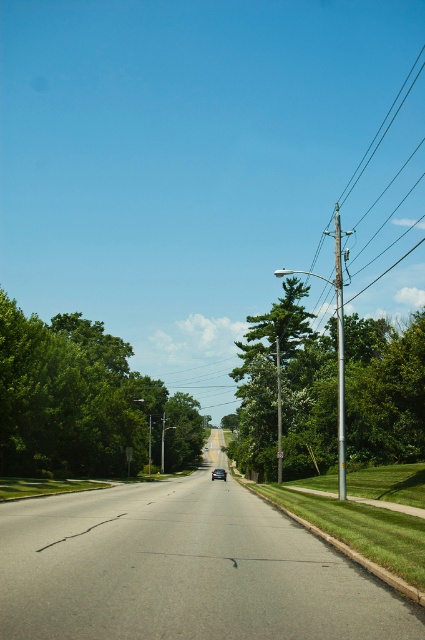
Can you confirm if green leafy tree at center-right is positioned to the right of shiny black sedan at center?

Correct, you'll find green leafy tree at center-right to the right of shiny black sedan at center.

Is green leafy tree at center-right to the left of shiny black sedan at center from the viewer's perspective?

In fact, green leafy tree at center-right is to the right of shiny black sedan at center.

The width and height of the screenshot is (425, 640). Find the location of `green leafy tree at center-right`. green leafy tree at center-right is located at coordinates (272, 378).

Looking at this image, who is more forward, (271, 368) or (285, 314)?

Point (271, 368) is in front.

Is green leafy tree at right smaller than green leafy tree at center-right?

Actually, green leafy tree at right might be larger than green leafy tree at center-right.

Locate an element on the screen. The image size is (425, 640). green leafy tree at right is located at coordinates (286, 390).

Based on the photo, between green leafy tree at left and green leafy tree at center-right, which one has less height?

With less height is green leafy tree at left.

Does green leafy tree at left appear on the right side of green leafy tree at center-right?

Incorrect, green leafy tree at left is not on the right side of green leafy tree at center-right.

At what (x,y) coordinates should I click in order to perform the action: click on green leafy tree at left. Please return your answer as a coordinate pair (x, y). This screenshot has width=425, height=640. Looking at the image, I should click on (82, 401).

At what (x,y) coordinates should I click in order to perform the action: click on green leafy tree at left. Please return your answer as a coordinate pair (x, y). Looking at the image, I should click on (82, 401).